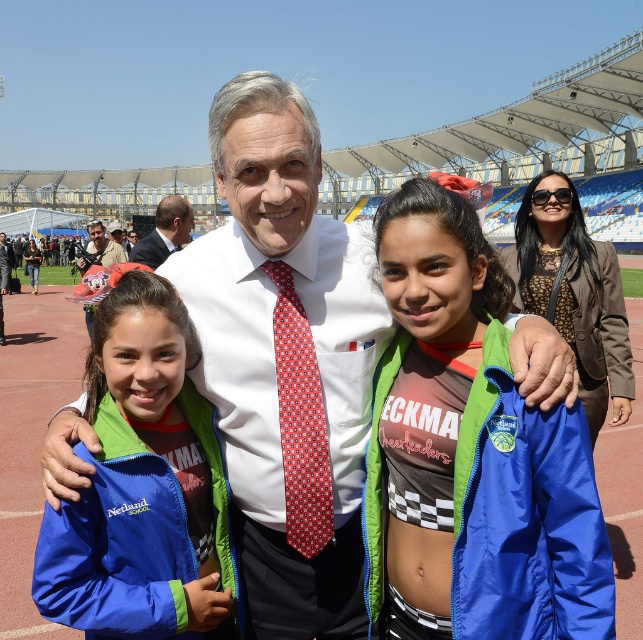
You are attending a sports event and see the smooth brown suit at upper left and the matte red tie at center in the group photo. Which object is positioned more to the left side of the image?

The smooth brown suit at upper left is positioned more to the left side of the image compared to the matte red tie at center.

You are a photographer trying to adjust the focus of your camera for the group photo. Since the smooth brown suit at upper left and the matte red tie at center are both in the frame, which one should you focus on first if you want to ensure the larger object is sharp?

The smooth brown suit at upper left is larger than the matte red tie at center, so you should focus on the smooth brown suit at upper left first to ensure it is sharp.

You are a photographer adjusting your camera settings for the group photo. You need to ensure both the blue fabric jacket at left and the smooth brown suit at upper left are in focus. Given their height difference, which object should you adjust the focus on first to accommodate the taller one?

The smooth brown suit at upper left is taller than the blue fabric jacket at left, so you should adjust the focus on the smooth brown suit at upper left first to accommodate its height.